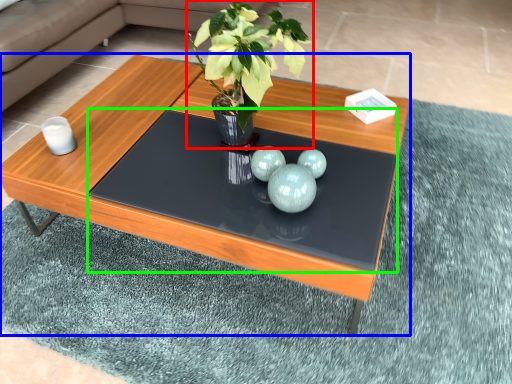
Question: Considering the real-world distances, which object is closest to houseplant (highlighted by a red box)? coffee table (highlighted by a blue box) or glass table (highlighted by a green box).

Choices:
 (A) coffee table
 (B) glass table

Answer: (B)